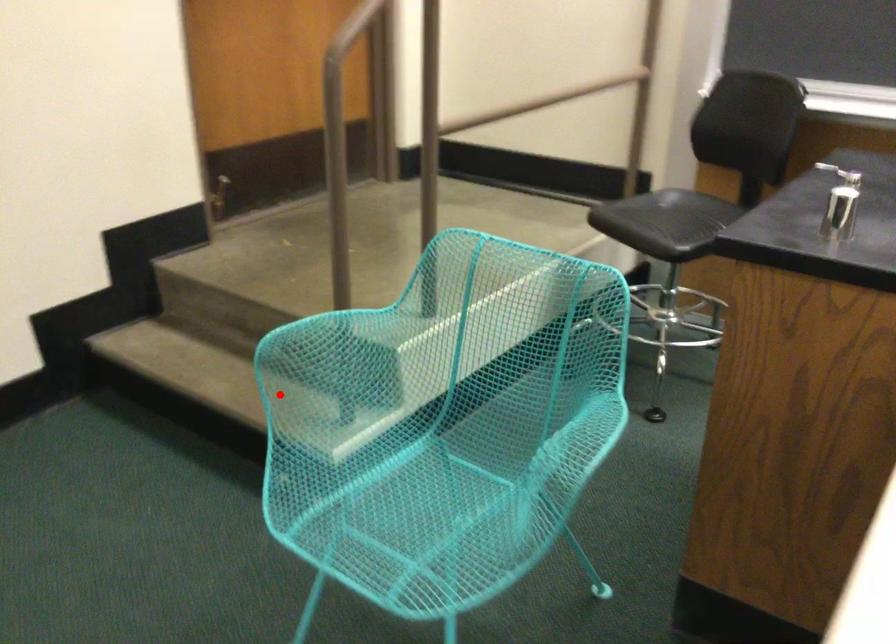
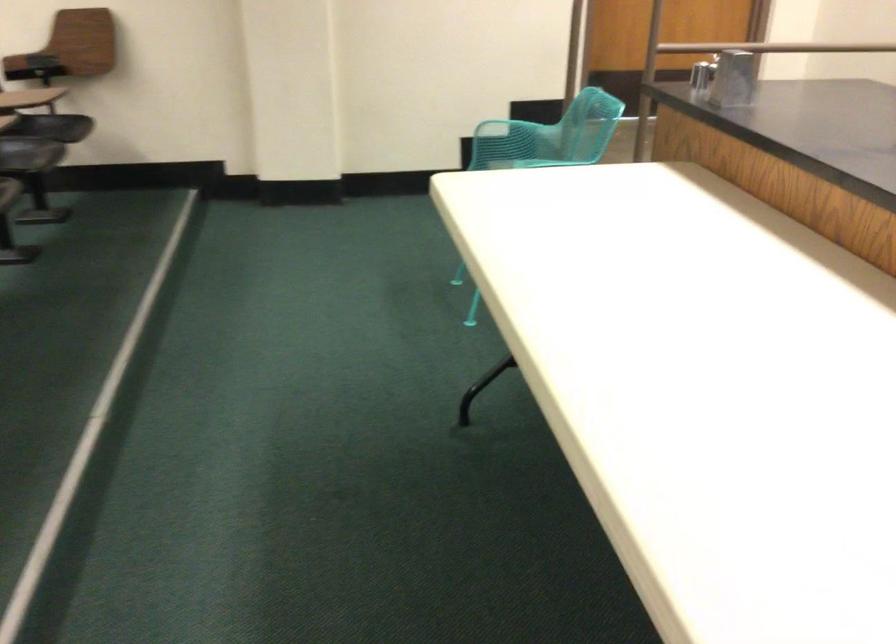
Question: I am providing you with two images of the same scene from different viewpoints. In image1, a red point is highlighted. Considering the same 3D point in image2, which of the following is correct?

Choices:
 (A) It is closer
 (B) It is farther

Answer: (B)